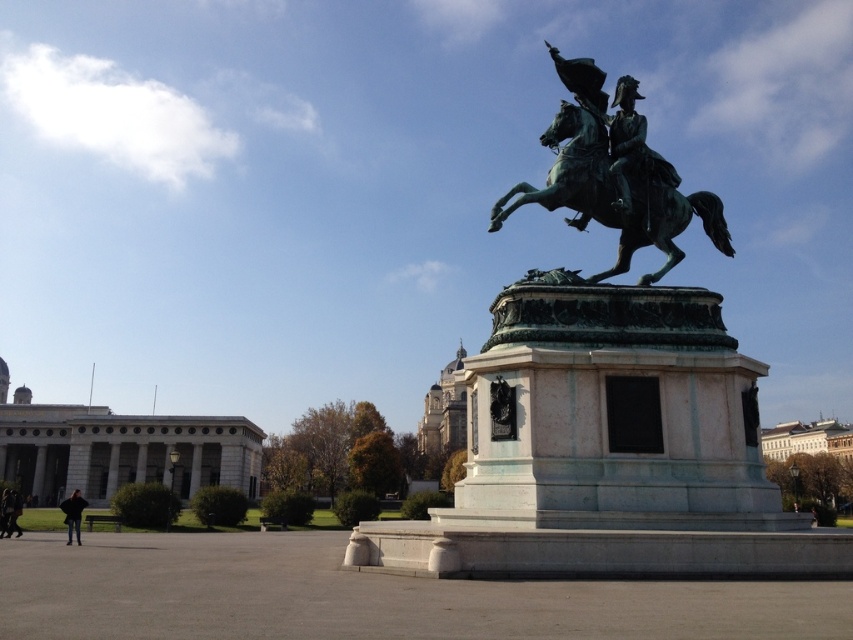
Which is above, green patina horse at center or green patina statue at upper center?

green patina horse at center

Does green patina horse at center have a larger size compared to green patina statue at upper center?

Indeed, green patina horse at center has a larger size compared to green patina statue at upper center.

Where is `green patina horse at center`? This screenshot has height=640, width=853. green patina horse at center is located at coordinates (614, 195).

Is green patina statue at center taller than green patina statue at upper center?

Yes.

Does green patina statue at center have a lesser height compared to green patina statue at upper center?

In fact, green patina statue at center may be taller than green patina statue at upper center.

Is point (592, 314) farther from viewer compared to point (624, 179)?

No.

This screenshot has height=640, width=853. I want to click on green patina statue at center, so click(x=612, y=368).

Who is more distant from viewer, (515, 200) or (68, 525)?

The point (68, 525) is behind.

Based on the photo, is green patina statue at center shorter than dark blue jacket at lower left?

Yes.

This screenshot has width=853, height=640. In order to click on green patina statue at center in this screenshot , I will do `click(612, 368)`.